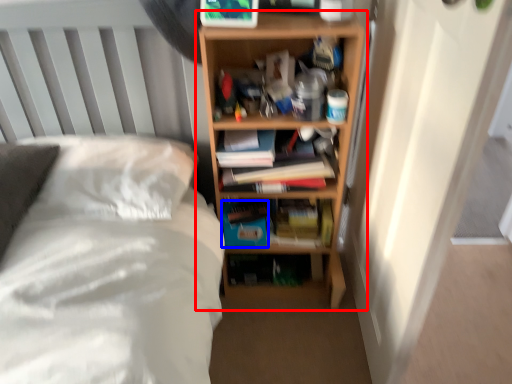
Question: Which object is closer to the camera taking this photo, shelf (highlighted by a red box) or paperback book (highlighted by a blue box)?

Choices:
 (A) shelf
 (B) paperback book

Answer: (A)